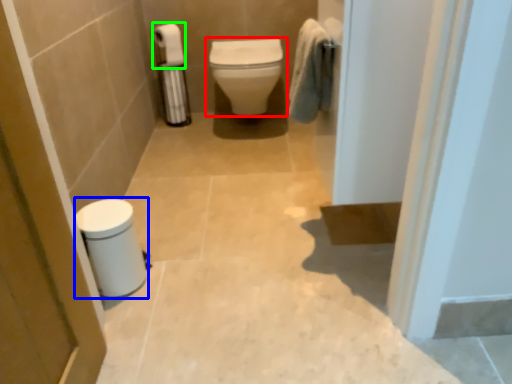
Question: Which object is positioned closest to toilet (highlighted by a red box)? Select from porcelain (highlighted by a blue box) and toilet paper (highlighted by a green box).

Choices:
 (A) porcelain
 (B) toilet paper

Answer: (B)